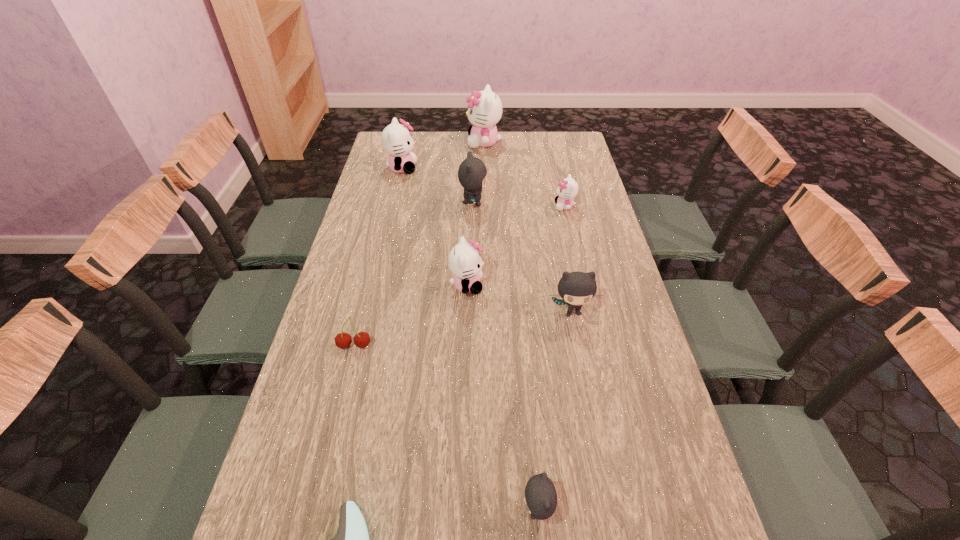
The width and height of the screenshot is (960, 540). What are the coordinates of `gray kitten that is the closest one to the seventh farthest object` in the screenshot? It's located at (576, 288).

What are the coordinates of `gray kitten that is the closest to the leftmost gray kitten` in the screenshot? It's located at (576, 288).

Where is `free space that satisfies the following two spatial constraints: 1. on the front-facing side of the second nearest white kitten; 2. on the surface of the seventh farthest object`? The image size is (960, 540). free space that satisfies the following two spatial constraints: 1. on the front-facing side of the second nearest white kitten; 2. on the surface of the seventh farthest object is located at coordinates (596, 346).